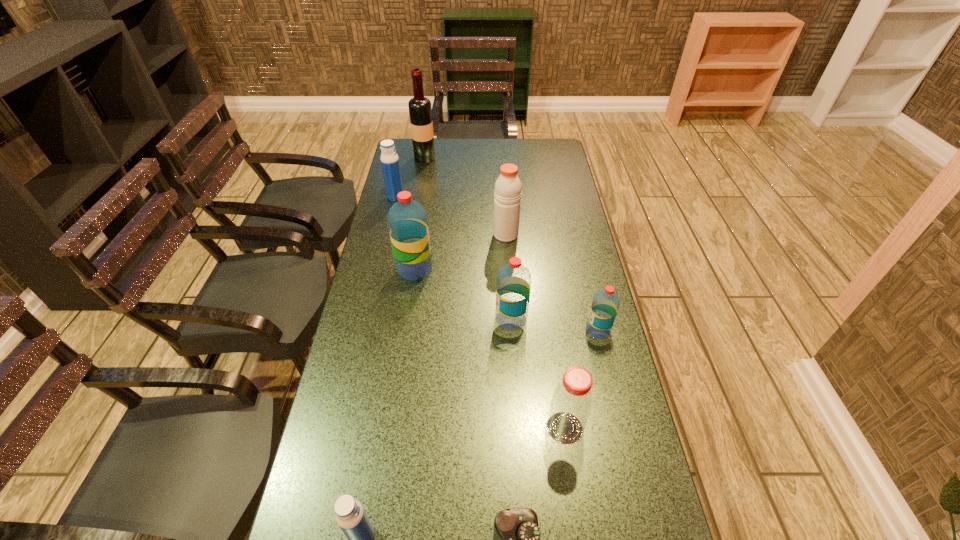
In the image, there is a desktop. Identify the location of vacant space at the far edge. (459, 141).

In the image, there is a desktop. Where is `free space at the left edge`? Image resolution: width=960 pixels, height=540 pixels. free space at the left edge is located at coordinates (414, 191).

Where is `vacant space at the right edge of the desktop`? vacant space at the right edge of the desktop is located at coordinates (567, 186).

This screenshot has height=540, width=960. I want to click on free space at the far right corner of the desktop, so click(555, 156).

Locate an element on the screen. The image size is (960, 540). free space between the biggest red water bottle and the second red water bottle from left to right is located at coordinates (463, 294).

Identify the location of vacant area that lies between the rightmost red water bottle and the wine bottle. tap(512, 244).

Locate an element on the screen. This screenshot has height=540, width=960. free space between the biggest red water bottle and the shaker is located at coordinates (460, 252).

The height and width of the screenshot is (540, 960). Find the location of `empty location between the second water bottle from right to left and the rightmost object`. empty location between the second water bottle from right to left and the rightmost object is located at coordinates (555, 325).

Locate an element on the screen. The width and height of the screenshot is (960, 540). vacant space that is in between the rightmost object and the second water bottle from right to left is located at coordinates (555, 325).

Locate which object ranks seventh in proximity to the tallest object. Please provide its 2D coordinates. Your answer should be formatted as a tuple, i.e. [(x, y)], where the tuple contains the x and y coordinates of a point satisfying the conditions above.

[(351, 517)]